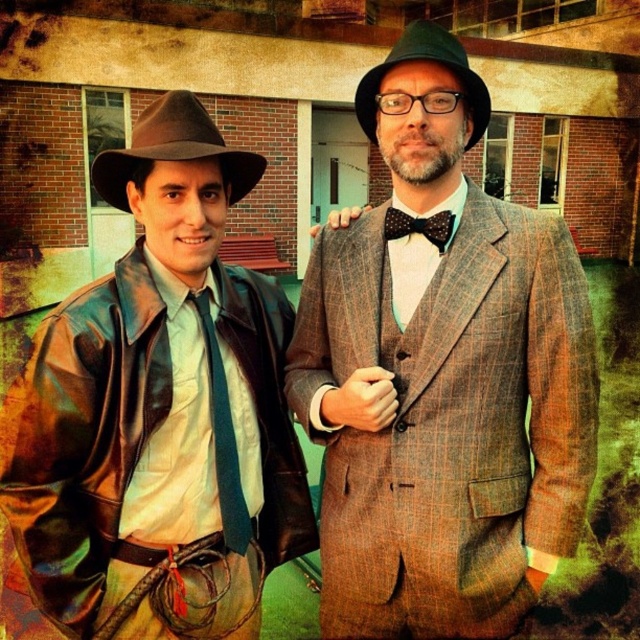
Question: Does leather jacket at left appear over black dotted fabric bow tie at center?

Choices:
 (A) yes
 (B) no

Answer: (B)

Question: Among these objects, which one is farthest from the camera?

Choices:
 (A) brown leather fedora at left
 (B) green silk tie at left

Answer: (B)

Question: Which point is closer to the camera?

Choices:
 (A) (314, 307)
 (B) (208, 124)

Answer: (B)

Question: Based on their relative distances, which object is nearer to the green felt fedora at upper center?

Choices:
 (A) black dotted fabric bow tie at center
 (B) leather jacket at left
 (C) brown leather fedora at left
 (D) green silk tie at left

Answer: (A)

Question: Can you confirm if plaid wool suit at center is bigger than green silk tie at left?

Choices:
 (A) no
 (B) yes

Answer: (B)

Question: Can you confirm if brown leather fedora at left is wider than green felt fedora at upper center?

Choices:
 (A) no
 (B) yes

Answer: (B)